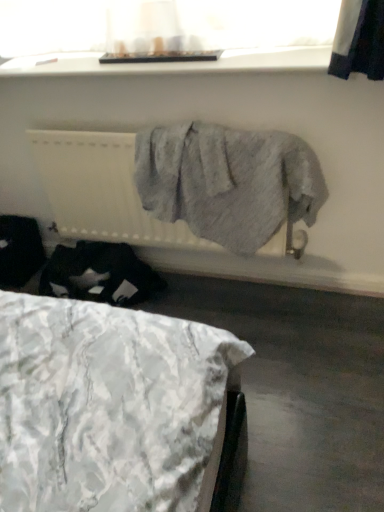
Question: Does translucent fabric at upper center have a larger size compared to white textured radiator at center?

Choices:
 (A) no
 (B) yes

Answer: (A)

Question: Does translucent fabric at upper center contain white textured radiator at center?

Choices:
 (A) yes
 (B) no

Answer: (B)

Question: Is translucent fabric at upper center outside of white textured radiator at center?

Choices:
 (A) yes
 (B) no

Answer: (A)

Question: Does translucent fabric at upper center touch white textured radiator at center?

Choices:
 (A) yes
 (B) no

Answer: (B)

Question: Is translucent fabric at upper center facing away from white textured radiator at center?

Choices:
 (A) yes
 (B) no

Answer: (B)

Question: Considering the positions of point (157, 224) and point (84, 356), is point (157, 224) closer or farther from the camera than point (84, 356)?

Choices:
 (A) farther
 (B) closer

Answer: (A)

Question: From the image's perspective, relative to white textured fabric at lower left, is white textured radiator at center above or below?

Choices:
 (A) above
 (B) below

Answer: (A)

Question: Is white textured radiator at center bigger or smaller than white textured fabric at lower left?

Choices:
 (A) big
 (B) small

Answer: (B)

Question: Looking at their shapes, would you say white textured radiator at center is wider or thinner than white textured fabric at lower left?

Choices:
 (A) thin
 (B) wide

Answer: (A)

Question: Choose the correct answer: Is translucent fabric at upper center inside white textured fabric at lower left or outside it?

Choices:
 (A) inside
 (B) outside

Answer: (B)

Question: Looking at their shapes, would you say translucent fabric at upper center is wider or thinner than white textured fabric at lower left?

Choices:
 (A) wide
 (B) thin

Answer: (B)

Question: From a real-world perspective, relative to white textured fabric at lower left, is translucent fabric at upper center vertically above or below?

Choices:
 (A) above
 (B) below

Answer: (A)

Question: Is translucent fabric at upper center bigger or smaller than white textured fabric at lower left?

Choices:
 (A) big
 (B) small

Answer: (B)

Question: Looking at their shapes, would you say white smooth window sill at upper center is wider or thinner than white textured fabric at lower left?

Choices:
 (A) thin
 (B) wide

Answer: (A)

Question: From the image's perspective, is white smooth window sill at upper center located above or below white textured fabric at lower left?

Choices:
 (A) above
 (B) below

Answer: (A)